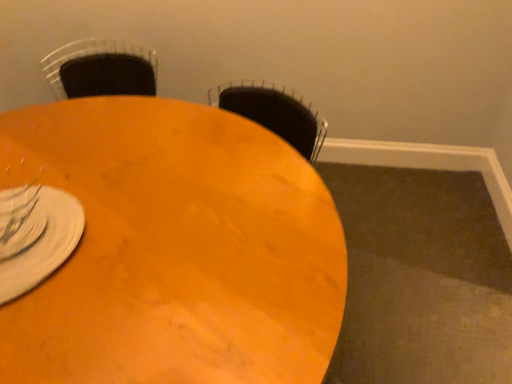
Where is `vacant space to the right of clear glass fork at lower left`? vacant space to the right of clear glass fork at lower left is located at coordinates pyautogui.click(x=72, y=222).